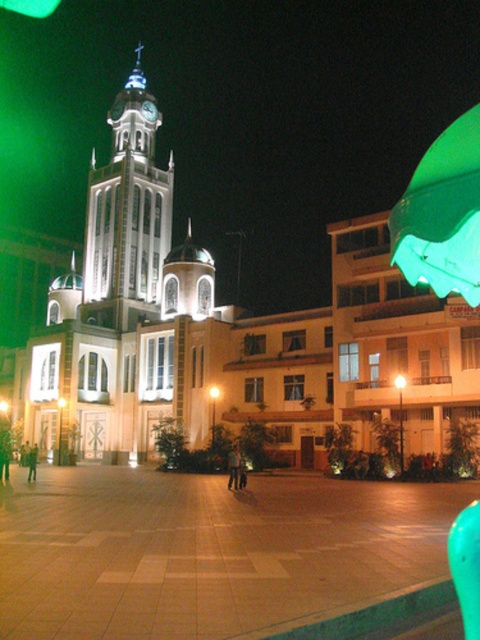
Question: Is smooth stone pavement at center further to the viewer compared to white glass clock tower at center?

Choices:
 (A) yes
 (B) no

Answer: (B)

Question: Among these objects, which one is farthest from the camera?

Choices:
 (A) smooth stone pavement at center
 (B) white glass clock tower at center
 (C) green fabric umbrella at upper right

Answer: (B)

Question: Among these objects, which one is farthest from the camera?

Choices:
 (A) green fabric umbrella at upper right
 (B) smooth stone pavement at center
 (C) white glass clock tower at center

Answer: (C)

Question: Among these objects, which one is farthest from the camera?

Choices:
 (A) smooth stone pavement at center
 (B) green fabric umbrella at upper right

Answer: (B)

Question: In this image, where is white glass clock tower at center located relative to green fabric umbrella at upper right?

Choices:
 (A) left
 (B) right

Answer: (A)

Question: From the image, what is the correct spatial relationship of smooth stone pavement at center in relation to white glass clock tower at center?

Choices:
 (A) left
 (B) right

Answer: (B)